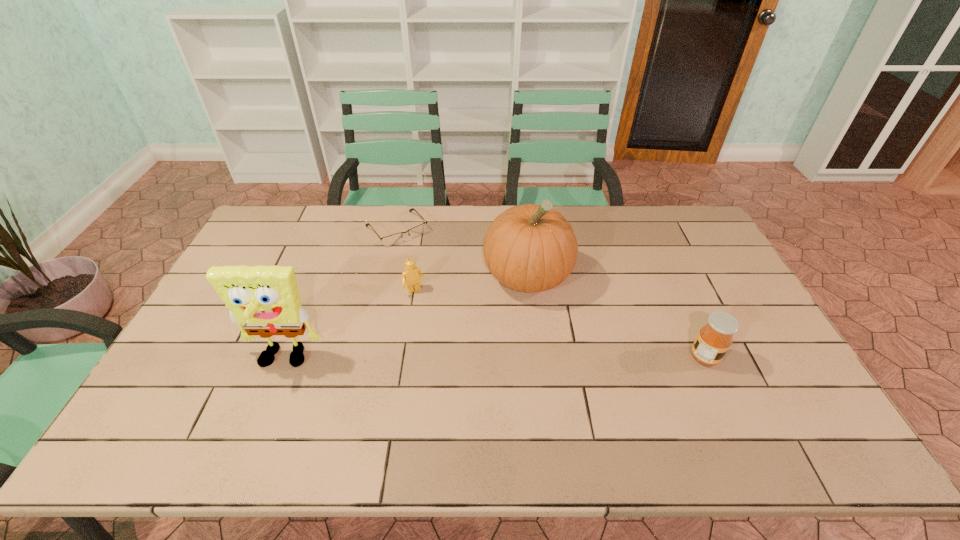
The width and height of the screenshot is (960, 540). Find the location of `vacant space at the far left corner of the desktop`. vacant space at the far left corner of the desktop is located at coordinates (282, 219).

Identify the location of vacant space at the near left corner of the desktop. The width and height of the screenshot is (960, 540). (171, 411).

This screenshot has height=540, width=960. I want to click on vacant space at the far right corner, so click(684, 234).

Locate an element on the screen. The width and height of the screenshot is (960, 540). free space between the Lego and the spectacles is located at coordinates (406, 260).

Locate an element on the screen. This screenshot has width=960, height=540. vacant point located between the leftmost object and the Lego is located at coordinates (349, 326).

The width and height of the screenshot is (960, 540). What are the coordinates of `vacant space that is in between the spectacles and the honey` in the screenshot? It's located at (551, 293).

Where is `free area in between the fourth object from left to right and the rightmost object`? free area in between the fourth object from left to right and the rightmost object is located at coordinates (616, 317).

At what (x,y) coordinates should I click in order to perform the action: click on free space between the Lego and the sponge. Please return your answer as a coordinate pair (x, y). Looking at the image, I should click on (349, 326).

Locate an element on the screen. vacant region between the honey and the fourth tallest object is located at coordinates coord(560,324).

This screenshot has height=540, width=960. What are the coordinates of `free spot between the Lego and the leftmost object` in the screenshot? It's located at (349, 326).